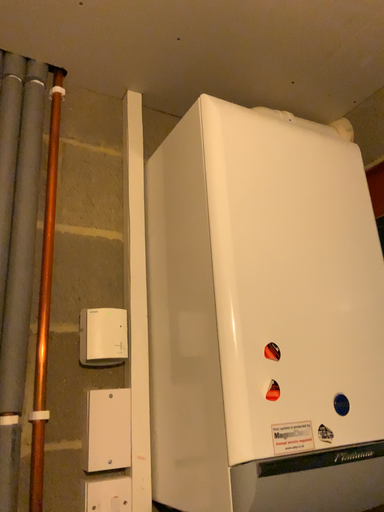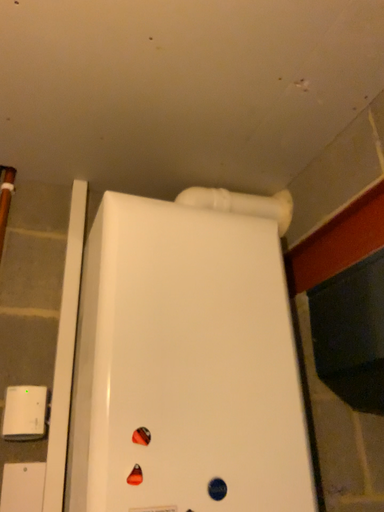
Question: How did the camera likely rotate when shooting the video?

Choices:
 (A) rotated left
 (B) rotated right

Answer: (A)